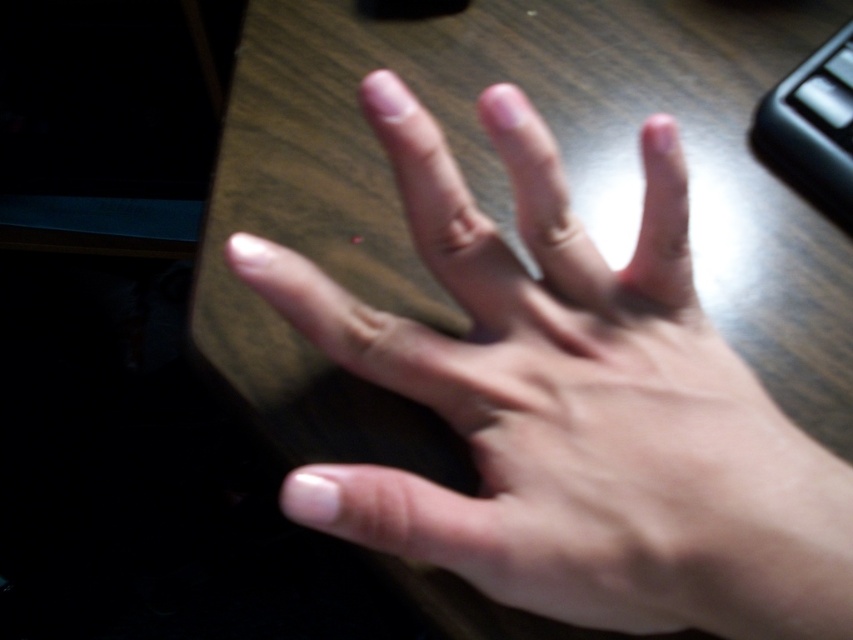
You are a photographer adjusting lighting for a photo shoot. You notice the smooth skin hand at center and the black plastic keyboard at upper right in the frame. Which object is closer to the camera lens?

The black plastic keyboard at upper right is closer to the camera lens because the smooth skin hand at center is positioned under it.

You are a photographer adjusting the lighting in the scene. You notice two points of light reflection on the wooden surface. The first point is at coordinates point (x=374, y=332) and the second is at point (x=828, y=157). Which point is closer to the camera?

Point (x=374, y=332) is in front of point (x=828, y=157), so it is closer to the camera.

Based on the scene description, where is the smooth skin hand at center located in terms of coordinates?

The smooth skin hand at center is located at coordinates (572, 406).